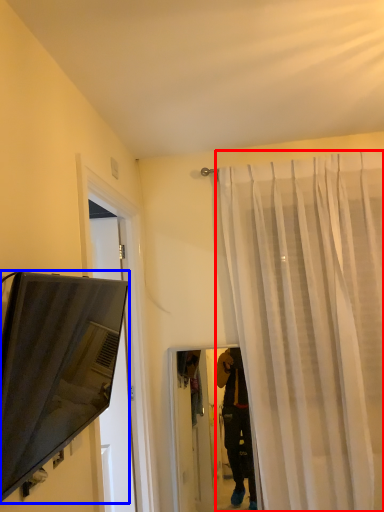
Question: Which object is further to the camera taking this photo, curtain (highlighted by a red box) or television (highlighted by a blue box)?

Choices:
 (A) curtain
 (B) television

Answer: (A)